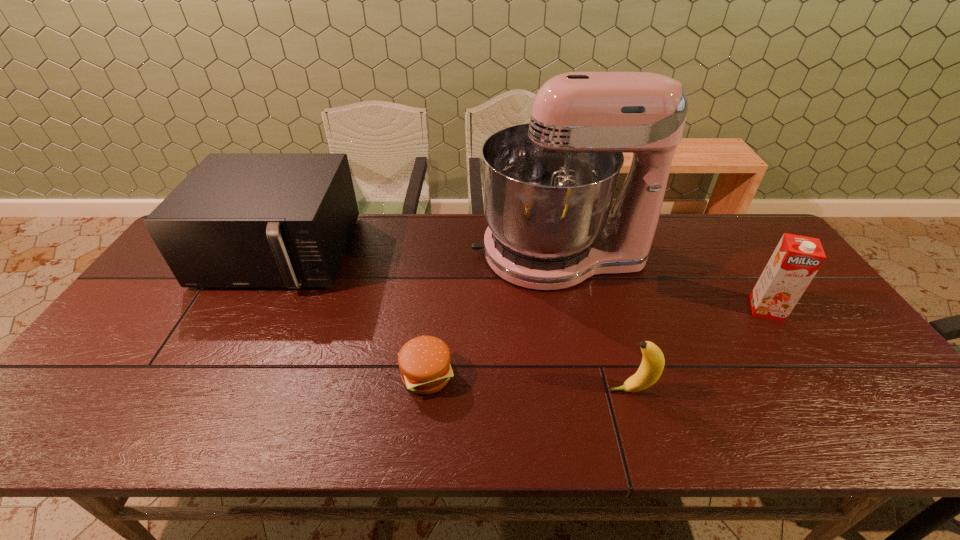
Where is `vacant region at the far edge`? vacant region at the far edge is located at coordinates (468, 247).

Identify the location of vacant region at the near edge of the desktop. (338, 408).

Find the location of a particular element. This screenshot has width=960, height=540. blank area at the far right corner is located at coordinates (756, 235).

I want to click on free space between the carton and the banana, so click(699, 350).

I want to click on vacant region between the banana and the tallest object, so click(x=594, y=322).

This screenshot has width=960, height=540. I want to click on free space between the tallest object and the shortest object, so click(492, 314).

Find the location of `free space between the second shortest object and the microwave oven`. free space between the second shortest object and the microwave oven is located at coordinates (455, 322).

Find the location of `vacant space in between the fourth tallest object and the mixer`. vacant space in between the fourth tallest object and the mixer is located at coordinates (594, 322).

Find the location of a particular element. The width and height of the screenshot is (960, 540). empty location between the mixer and the hamburger is located at coordinates (492, 314).

This screenshot has width=960, height=540. In order to click on free space between the microwave oven and the shortest object in this screenshot , I will do `click(353, 314)`.